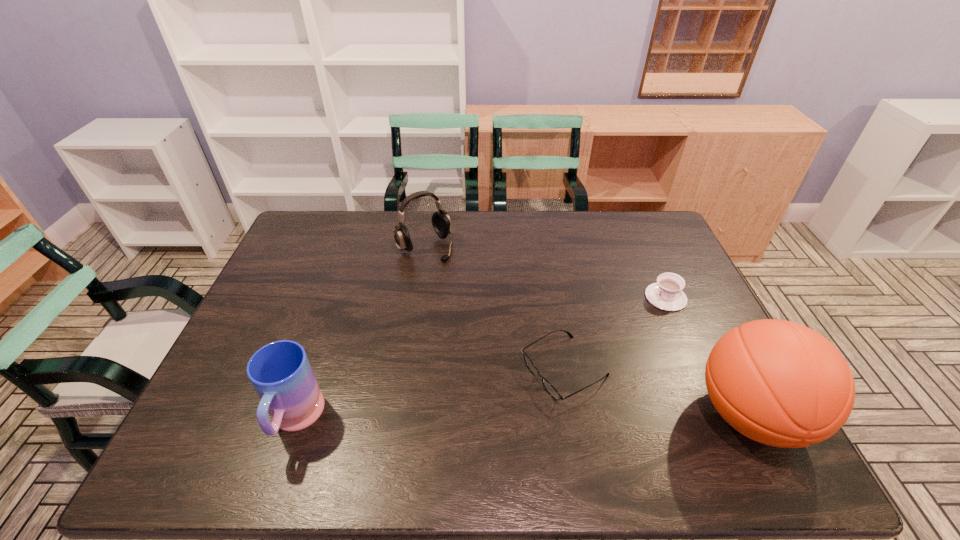
The image size is (960, 540). I want to click on unoccupied position between the third object from right to left and the headset, so click(x=494, y=309).

Identify the location of free space between the third object from right to left and the second farthest object. This screenshot has height=540, width=960. (615, 334).

In order to click on vacant area that lies between the second object from left to right and the third object from left to right in this screenshot , I will do `click(494, 309)`.

The image size is (960, 540). What are the coordinates of `blank region between the farthest object and the second shortest object` in the screenshot? It's located at (545, 272).

The image size is (960, 540). What are the coordinates of `vacant space in between the tallest object and the mug` in the screenshot? It's located at (522, 417).

At what (x,y) coordinates should I click in order to perform the action: click on free space between the spectacles and the leftmost object. Please return your answer as a coordinate pair (x, y). This screenshot has height=540, width=960. Looking at the image, I should click on (430, 395).

You are a GUI agent. You are given a task and a screenshot of the screen. Output one action in this format:
    pyautogui.click(x=<x>, y=<y>)
    Task: Click on the free space between the tallest object and the leftmost object
    Image resolution: width=960 pixels, height=540 pixels.
    Given the screenshot: What is the action you would take?
    pyautogui.click(x=522, y=417)

You are a GUI agent. You are given a task and a screenshot of the screen. Output one action in this format:
    pyautogui.click(x=<x>, y=<y>)
    Task: Click on the vacant region between the third object from left to right and the leftmost object
    
    Given the screenshot: What is the action you would take?
    tap(430, 395)

Find the location of a particular element. This screenshot has width=960, height=540. free space that is in between the fourth nearest object and the farthest object is located at coordinates (545, 272).

Locate an element on the screen. The width and height of the screenshot is (960, 540). object identified as the third closest to the second object from left to right is located at coordinates [x=666, y=294].